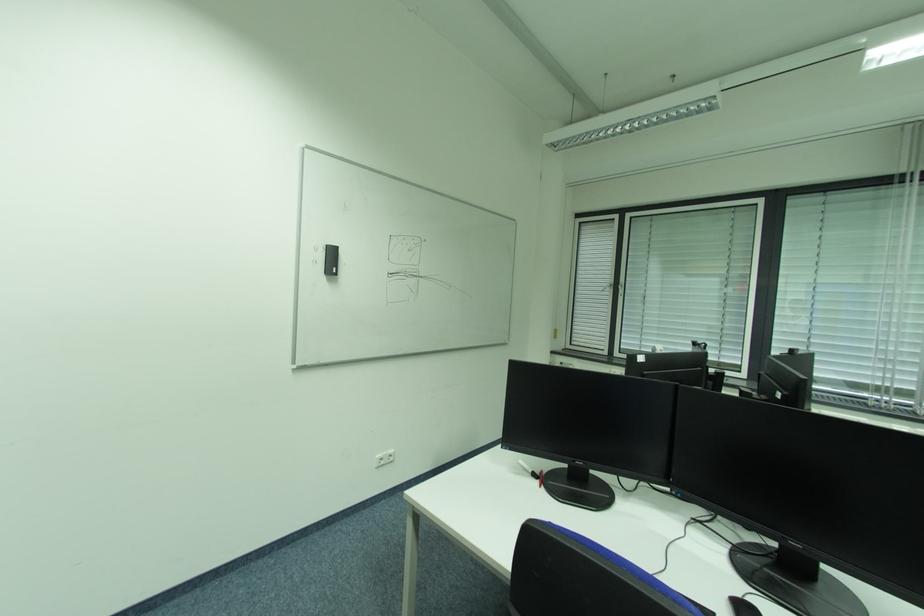
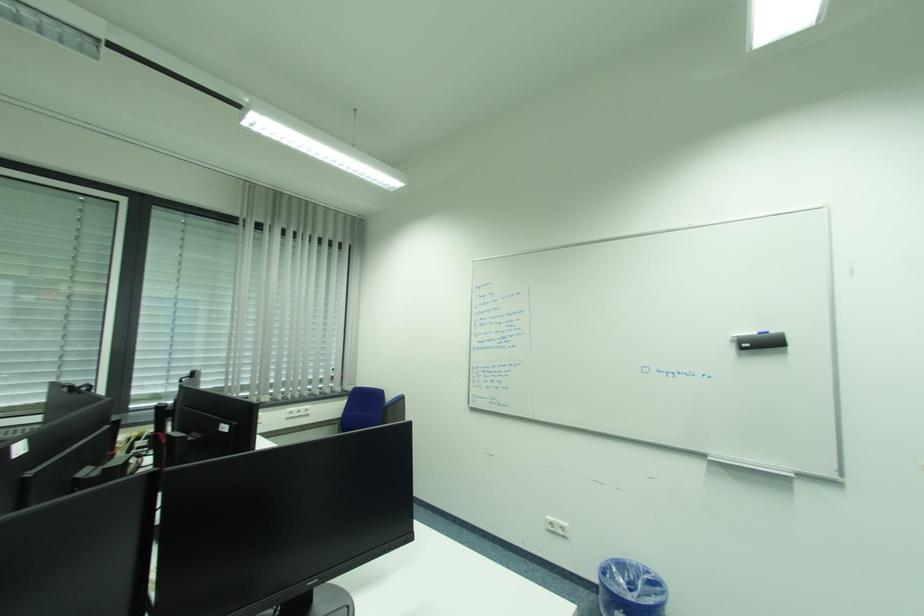
Question: The camera is either moving clockwise (left) or counter-clockwise (right) around the object. The first image is from the beginning of the video and the second image is from the end. Is the camera moving left or right when shooting the video?

Choices:
 (A) Left
 (B) Right

Answer: (A)